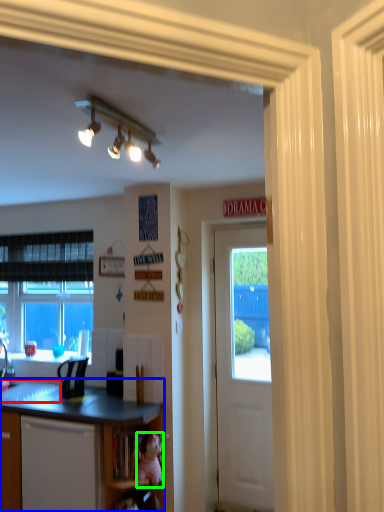
Question: Based on their relative distances, which object is farther from sink (highlighted by a red box)? Choose from countertop (highlighted by a blue box) and teddy bear (highlighted by a green box).

Choices:
 (A) countertop
 (B) teddy bear

Answer: (B)